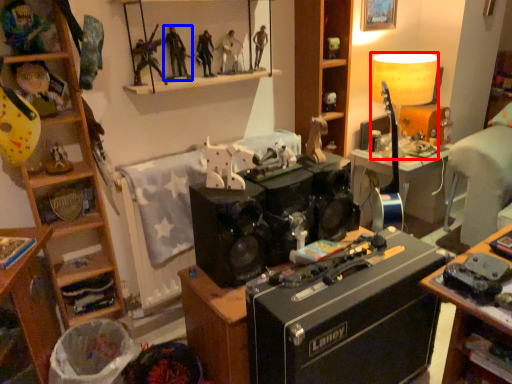
Question: Which point is closer to the camera, lamp (highlighted by a red box) or person (highlighted by a blue box)?

Choices:
 (A) lamp
 (B) person

Answer: (B)